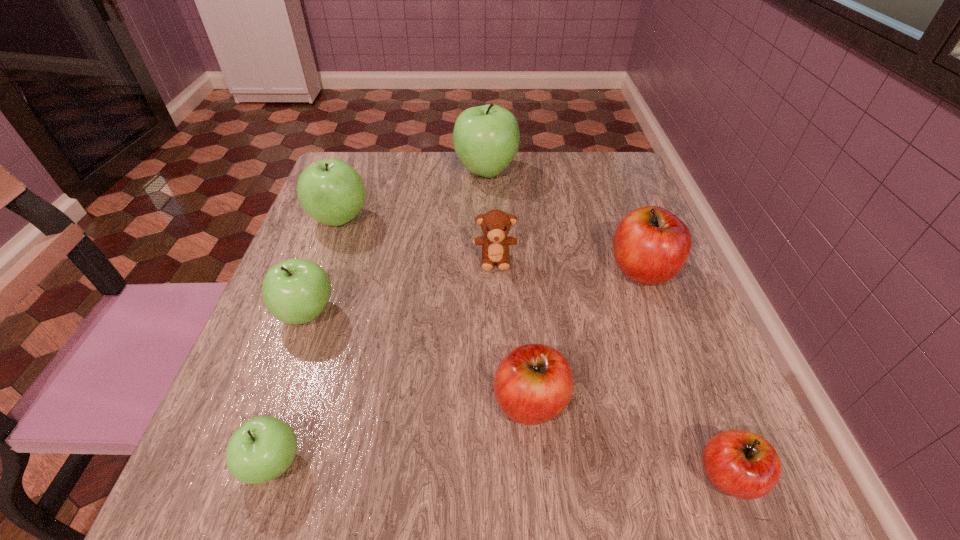
Where is `vacant area that lies between the farthest object and the second farthest apple`? This screenshot has height=540, width=960. vacant area that lies between the farthest object and the second farthest apple is located at coordinates (413, 195).

Locate an element on the screen. This screenshot has width=960, height=540. vacant space that is in between the smallest green apple and the second farthest green apple is located at coordinates (306, 341).

The width and height of the screenshot is (960, 540). Find the location of `vacant space in between the seventh nearest object and the farthest apple`. vacant space in between the seventh nearest object and the farthest apple is located at coordinates (413, 195).

What are the coordinates of `unoccupied position between the second smallest red apple and the biggest red apple` in the screenshot? It's located at (587, 336).

Where is `empty space between the smallest red apple and the rightmost green apple`? Image resolution: width=960 pixels, height=540 pixels. empty space between the smallest red apple and the rightmost green apple is located at coordinates (608, 323).

Locate an element on the screen. The height and width of the screenshot is (540, 960). free space between the tallest apple and the smallest red apple is located at coordinates (608, 323).

This screenshot has width=960, height=540. In order to click on vacant space in between the farthest object and the third biggest green apple in this screenshot , I will do `click(396, 242)`.

Identify the location of vacant space that is in between the third biggest green apple and the third nearest green apple. The image size is (960, 540). (324, 266).

Find the location of a particular element. free space between the smallest green apple and the second farthest green apple is located at coordinates (306, 341).

The image size is (960, 540). I want to click on object that can be found as the fifth closest to the smallest green apple, so click(742, 464).